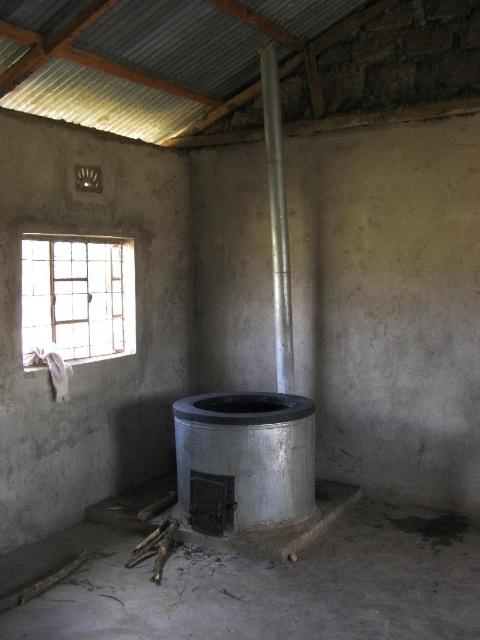
You are standing in the room and want to look outside through the clear glass window at upper left. To do so, which direction should you turn your head relative to the silver metallic chimney at center?

You should turn your head to the left relative to the silver metallic chimney at center because the clear glass window at upper left is positioned to the left of the silver metallic chimney at center.

You are a painter who needs to decide which object to paint first between the clear glass window at upper left and the silver metallic chimney at center. Which object has a bigger surface area to paint?

The clear glass window at upper left is larger in size than the silver metallic chimney at center, so it has a bigger surface area to paint.